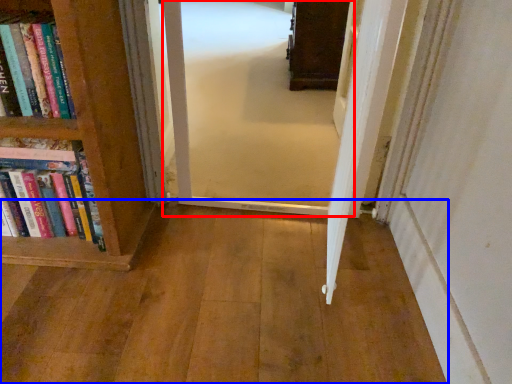
Question: Which object is further to the camera taking this photo, corridor (highlighted by a red box) or corridor (highlighted by a blue box)?

Choices:
 (A) corridor
 (B) corridor

Answer: (A)